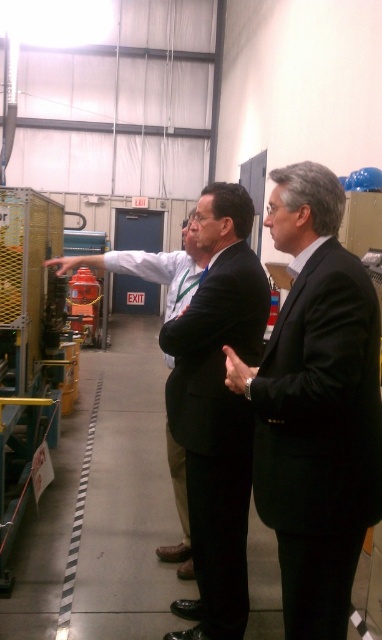
You are standing in the workshop and need to reach the point at coordinates (226, 376). The man in the light shirt is standing between you and that point. Can you walk straight to the point without going around him?

The point at coordinates (226, 376) is 6.41 feet from the camera. Since the man in the light shirt is between you and the point, you would need to go around him to reach it directly, as walking straight would require passing through him.

You are standing in a workshop and want to reach a specific point marked at coordinates point (199, 532). If you are currently 2.5 meters away from this point, how much closer do you need to move to be exactly at the point?

The distance of point (199, 532) from viewer is 2.10 meters. To reach the point from your current position of 2.5 meters away, you need to move 0.4 meters closer.

You are an engineer inspecting a machine in the workshop. You notice two hands in the image, the black matte hand at center and the smooth yellow hand at center. Which hand is larger?

The smooth yellow hand at center is larger than the black matte hand at center.